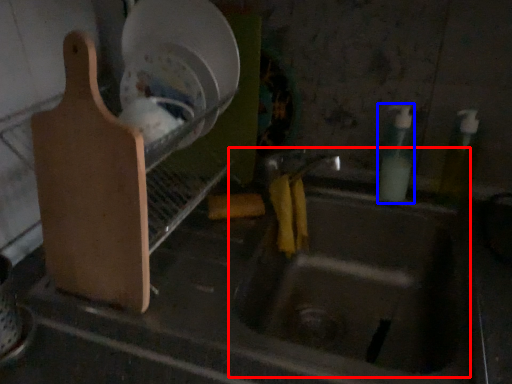
Question: Which object appears farthest to the camera in this image, sink (highlighted by a red box) or bottle (highlighted by a blue box)?

Choices:
 (A) sink
 (B) bottle

Answer: (B)